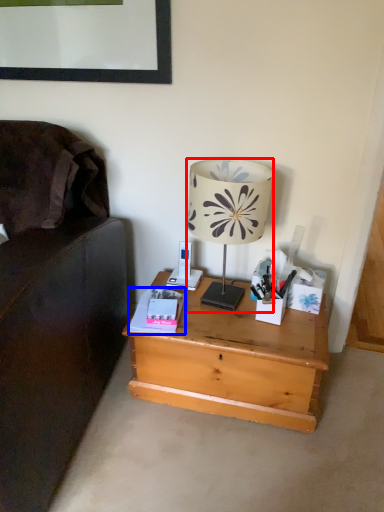
Question: Which object appears closest to the camera in this image, lamp (highlighted by a red box) or paperback book (highlighted by a blue box)?

Choices:
 (A) lamp
 (B) paperback book

Answer: (A)